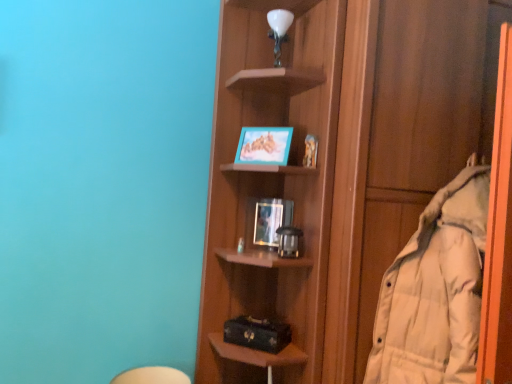
In order to click on teal matte picture frame at upper center, positioned as the 2th picture frame in bottom-to-top order in this screenshot , I will do `click(264, 145)`.

Where is `matte plastic picture frame at middle, marked as the first picture frame in a bottom-to-top arrangement`? This screenshot has width=512, height=384. matte plastic picture frame at middle, marked as the first picture frame in a bottom-to-top arrangement is located at coordinates (271, 220).

At what (x,y) coordinates should I click in order to perform the action: click on teal matte picture frame at upper center, which ranks as the first picture frame in top-to-bottom order. Please return your answer as a coordinate pair (x, y). Image resolution: width=512 pixels, height=384 pixels. Looking at the image, I should click on (264, 145).

From a real-world perspective, between white down-filled coat at right and matte plastic picture frame at middle, marked as the first picture frame in a bottom-to-top arrangement, who is vertically lower?

white down-filled coat at right, from a real-world perspective.

Which of these two, white down-filled coat at right or matte plastic picture frame at middle, the 2th picture frame from the top, stands shorter?

With less height is matte plastic picture frame at middle, the 2th picture frame from the top.

Considering the points (396, 271) and (279, 203), which point is in front, point (396, 271) or point (279, 203)?

Point (396, 271)

How distant is white down-filled coat at right from matte plastic picture frame at middle, marked as the first picture frame in a bottom-to-top arrangement?

white down-filled coat at right is 21.96 inches away from matte plastic picture frame at middle, marked as the first picture frame in a bottom-to-top arrangement.

Relative to white down-filled coat at right, is matte plastic picture frame at middle, marked as the first picture frame in a bottom-to-top arrangement, in front or behind?

matte plastic picture frame at middle, marked as the first picture frame in a bottom-to-top arrangement, is behind white down-filled coat at right.

From a real-world perspective, is matte plastic picture frame at middle, the 2th picture frame from the top, under white down-filled coat at right?

No, from a real-world perspective, matte plastic picture frame at middle, the 2th picture frame from the top, is not under white down-filled coat at right.

Considering the sizes of matte plastic picture frame at middle, the 2th picture frame from the top, and white down-filled coat at right in the image, is matte plastic picture frame at middle, the 2th picture frame from the top, bigger or smaller than white down-filled coat at right?

Clearly, matte plastic picture frame at middle, the 2th picture frame from the top, is smaller in size than white down-filled coat at right.

Considering the relative sizes of matte plastic picture frame at middle, marked as the first picture frame in a bottom-to-top arrangement, and white down-filled coat at right in the image provided, is matte plastic picture frame at middle, marked as the first picture frame in a bottom-to-top arrangement, wider than white down-filled coat at right?

No.

Which of these two, teal matte picture frame at upper center, which ranks as the first picture frame in top-to-bottom order, or white down-filled coat at right, stands taller?

With more height is white down-filled coat at right.

Is teal matte picture frame at upper center, which ranks as the first picture frame in top-to-bottom order, not within white down-filled coat at right?

Yes.

Is teal matte picture frame at upper center, which ranks as the first picture frame in top-to-bottom order, facing towards white down-filled coat at right?

No.

This screenshot has width=512, height=384. I want to click on the 2nd picture frame to the left of the white down-filled coat at right, counting from the anchor's position, so click(264, 145).

Based on their sizes in the image, would you say teal matte picture frame at upper center, positioned as the 2th picture frame in bottom-to-top order, is bigger or smaller than wooden shelf at center?

In the image, teal matte picture frame at upper center, positioned as the 2th picture frame in bottom-to-top order, appears to be smaller than wooden shelf at center.

Is teal matte picture frame at upper center, positioned as the 2th picture frame in bottom-to-top order, shorter than wooden shelf at center?

Yes, teal matte picture frame at upper center, positioned as the 2th picture frame in bottom-to-top order, is shorter than wooden shelf at center.

How many degrees apart are the facing directions of teal matte picture frame at upper center, positioned as the 2th picture frame in bottom-to-top order, and wooden shelf at center?

40.1 degrees separate the facing orientations of teal matte picture frame at upper center, positioned as the 2th picture frame in bottom-to-top order, and wooden shelf at center.

Is teal matte picture frame at upper center, positioned as the 2th picture frame in bottom-to-top order, situated inside wooden shelf at center or outside?

teal matte picture frame at upper center, positioned as the 2th picture frame in bottom-to-top order, is not inside wooden shelf at center, it's outside.

From a real-world perspective, is white down-filled coat at right over wooden shelf at center?

No.

Which object is positioned more to the right, white down-filled coat at right or wooden shelf at center?

wooden shelf at center is more to the right.

In terms of height, does white down-filled coat at right look taller or shorter compared to wooden shelf at center?

white down-filled coat at right is shorter than wooden shelf at center.

Can you confirm if white down-filled coat at right is smaller than wooden shelf at center?

Yes.

From the image's perspective, between wooden shelf at center and matte plastic picture frame at middle, the 2th picture frame from the top, which one is located above?

wooden shelf at center is shown above in the image.

Is wooden shelf at center at the left side of matte plastic picture frame at middle, marked as the first picture frame in a bottom-to-top arrangement?

Incorrect, wooden shelf at center is not on the left side of matte plastic picture frame at middle, marked as the first picture frame in a bottom-to-top arrangement.

In the scene shown: Which object is wider, wooden shelf at center or matte plastic picture frame at middle, marked as the first picture frame in a bottom-to-top arrangement?

Wider between the two is wooden shelf at center.

Who is bigger, matte plastic picture frame at middle, marked as the first picture frame in a bottom-to-top arrangement, or teal matte picture frame at upper center, positioned as the 2th picture frame in bottom-to-top order?

teal matte picture frame at upper center, positioned as the 2th picture frame in bottom-to-top order, is bigger.

Who is shorter, matte plastic picture frame at middle, the 2th picture frame from the top, or teal matte picture frame at upper center, which ranks as the first picture frame in top-to-bottom order?

Standing shorter between the two is teal matte picture frame at upper center, which ranks as the first picture frame in top-to-bottom order.

Does matte plastic picture frame at middle, the 2th picture frame from the top, turn towards teal matte picture frame at upper center, which ranks as the first picture frame in top-to-bottom order?

No, matte plastic picture frame at middle, the 2th picture frame from the top, is not turned towards teal matte picture frame at upper center, which ranks as the first picture frame in top-to-bottom order.

Locate an element on the screen. picture frame on the right of teal matte picture frame at upper center, which ranks as the first picture frame in top-to-bottom order is located at coordinates (271, 220).

Identify the location of picture frame that is the 1st one above the white down-filled coat at right (from a real-world perspective). (271, 220).

The image size is (512, 384). In order to click on the 1st picture frame to the left of the white down-filled coat at right, counting from the anchor's position in this screenshot , I will do `click(271, 220)`.

In the scene shown: Based on their spatial positions, is white down-filled coat at right or wooden shelf at center closer to teal matte picture frame at upper center, which ranks as the first picture frame in top-to-bottom order?

Among the two, wooden shelf at center is located nearer to teal matte picture frame at upper center, which ranks as the first picture frame in top-to-bottom order.

When comparing their distances from teal matte picture frame at upper center, positioned as the 2th picture frame in bottom-to-top order, does wooden shelf at center or white down-filled coat at right seem closer?

wooden shelf at center lies closer to teal matte picture frame at upper center, positioned as the 2th picture frame in bottom-to-top order, than the other object.

Considering their positions, is teal matte picture frame at upper center, which ranks as the first picture frame in top-to-bottom order, positioned closer to wooden shelf at center than white down-filled coat at right?

Among the two, white down-filled coat at right is located nearer to wooden shelf at center.

From the picture: From the image, which object appears to be nearer to matte plastic picture frame at middle, marked as the first picture frame in a bottom-to-top arrangement, teal matte picture frame at upper center, positioned as the 2th picture frame in bottom-to-top order, or white down-filled coat at right?

teal matte picture frame at upper center, positioned as the 2th picture frame in bottom-to-top order, is positioned closer to the anchor matte plastic picture frame at middle, marked as the first picture frame in a bottom-to-top arrangement.

When comparing their distances from wooden shelf at center, does matte plastic picture frame at middle, the 2th picture frame from the top, or teal matte picture frame at upper center, positioned as the 2th picture frame in bottom-to-top order, seem further?

Based on the image, matte plastic picture frame at middle, the 2th picture frame from the top, appears to be further to wooden shelf at center.

Based on their spatial positions, is white down-filled coat at right or teal matte picture frame at upper center, positioned as the 2th picture frame in bottom-to-top order, closer to matte plastic picture frame at middle, the 2th picture frame from the top?

teal matte picture frame at upper center, positioned as the 2th picture frame in bottom-to-top order, lies closer to matte plastic picture frame at middle, the 2th picture frame from the top, than the other object.

When comparing their distances from teal matte picture frame at upper center, positioned as the 2th picture frame in bottom-to-top order, does white down-filled coat at right or matte plastic picture frame at middle, marked as the first picture frame in a bottom-to-top arrangement, seem closer?

matte plastic picture frame at middle, marked as the first picture frame in a bottom-to-top arrangement.

Which object lies nearer to the anchor point white down-filled coat at right, wooden shelf at center or teal matte picture frame at upper center, positioned as the 2th picture frame in bottom-to-top order?

wooden shelf at center.

This screenshot has height=384, width=512. Identify the location of coat located between matte plastic picture frame at middle, the 2th picture frame from the top, and wooden shelf at center in the left-right direction. (435, 291).

I want to click on picture frame located between teal matte picture frame at upper center, which ranks as the first picture frame in top-to-bottom order, and white down-filled coat at right in the left-right direction, so click(x=271, y=220).

At what (x,y) coordinates should I click in order to perform the action: click on coat between teal matte picture frame at upper center, which ranks as the first picture frame in top-to-bottom order, and wooden shelf at center. Please return your answer as a coordinate pair (x, y). The height and width of the screenshot is (384, 512). Looking at the image, I should click on (435, 291).

The width and height of the screenshot is (512, 384). I want to click on picture frame located between teal matte picture frame at upper center, which ranks as the first picture frame in top-to-bottom order, and wooden shelf at center in the left-right direction, so click(271, 220).